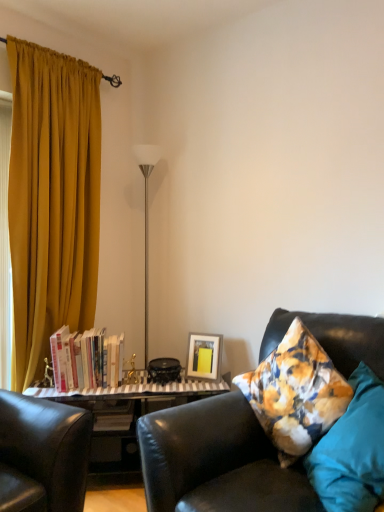
Question: Is leather couch at right outside teal fabric pillow at right?

Choices:
 (A) no
 (B) yes

Answer: (B)

Question: Considering the relative sizes of leather couch at right and teal fabric pillow at right in the image provided, is leather couch at right thinner than teal fabric pillow at right?

Choices:
 (A) yes
 (B) no

Answer: (B)

Question: Can you confirm if leather couch at right is shorter than teal fabric pillow at right?

Choices:
 (A) yes
 (B) no

Answer: (B)

Question: Would you consider leather couch at right to be distant from teal fabric pillow at right?

Choices:
 (A) no
 (B) yes

Answer: (A)

Question: Considering the relative sizes of leather couch at right and teal fabric pillow at right in the image provided, is leather couch at right taller than teal fabric pillow at right?

Choices:
 (A) no
 (B) yes

Answer: (B)

Question: Is silver/metallic floor lamp at center in front of or behind matte yellow picture frame at center in the image?

Choices:
 (A) front
 (B) behind

Answer: (B)

Question: Is silver/metallic floor lamp at center inside the boundaries of matte yellow picture frame at center, or outside?

Choices:
 (A) inside
 (B) outside

Answer: (B)

Question: Based on their sizes in the image, would you say silver/metallic floor lamp at center is bigger or smaller than matte yellow picture frame at center?

Choices:
 (A) big
 (B) small

Answer: (A)

Question: From a real-world perspective, is silver/metallic floor lamp at center positioned above or below matte yellow picture frame at center?

Choices:
 (A) above
 (B) below

Answer: (A)

Question: Is leather couch at right wider or thinner than matte yellow picture frame at center?

Choices:
 (A) wide
 (B) thin

Answer: (A)

Question: Is leather couch at right situated inside matte yellow picture frame at center or outside?

Choices:
 (A) outside
 (B) inside

Answer: (A)

Question: Based on their sizes in the image, would you say leather couch at right is bigger or smaller than matte yellow picture frame at center?

Choices:
 (A) small
 (B) big

Answer: (B)

Question: From the image's perspective, is leather couch at right positioned above or below matte yellow picture frame at center?

Choices:
 (A) above
 (B) below

Answer: (B)

Question: From the image's perspective, is matte yellow picture frame at center above or below leather couch at right?

Choices:
 (A) above
 (B) below

Answer: (A)

Question: In terms of width, does matte yellow picture frame at center look wider or thinner when compared to leather couch at right?

Choices:
 (A) wide
 (B) thin

Answer: (B)